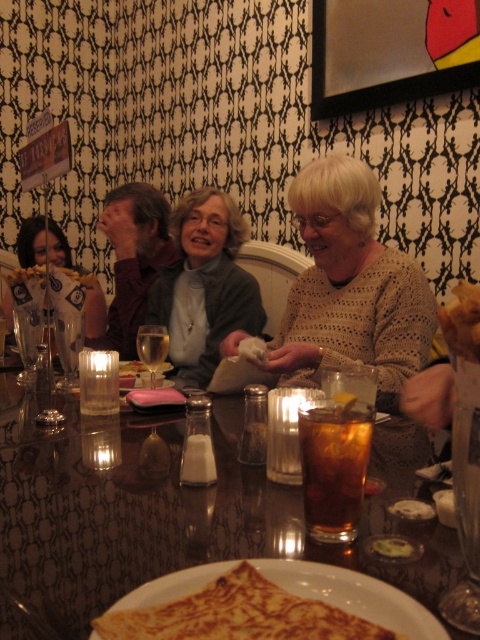
Who is positioned more to the left, golden crispy chicken at center or translucent glass at table center?

translucent glass at table center is more to the left.

Is golden crispy chicken at center wider than translucent glass at table center?

In fact, golden crispy chicken at center might be narrower than translucent glass at table center.

Who is more forward, (446, 339) or (159, 342)?

Positioned in front is point (446, 339).

Where is `golden crispy chicken at center`? This screenshot has width=480, height=640. golden crispy chicken at center is located at coordinates (462, 321).

Can you confirm if golden-brown crepe at center is smaller than translucent glass drink at center?

Correct, golden-brown crepe at center occupies less space than translucent glass drink at center.

Between golden-brown crepe at center and translucent glass drink at center, which one has less height?

With less height is golden-brown crepe at center.

The image size is (480, 640). I want to click on golden-brown crepe at center, so click(266, 605).

Does shiny glass table at center have a lesser height compared to translucent glass at table center?

Yes, shiny glass table at center is shorter than translucent glass at table center.

In the scene shown: Is shiny glass table at center taller than translucent glass at table center?

In fact, shiny glass table at center may be shorter than translucent glass at table center.

Find the location of a particular element. This screenshot has width=480, height=640. shiny glass table at center is located at coordinates (173, 515).